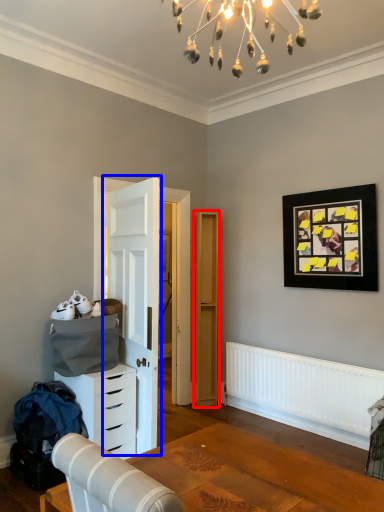
Question: Which of the following is the farthest to the observer, file cabinet (highlighted by a red box) or door (highlighted by a blue box)?

Choices:
 (A) file cabinet
 (B) door

Answer: (A)